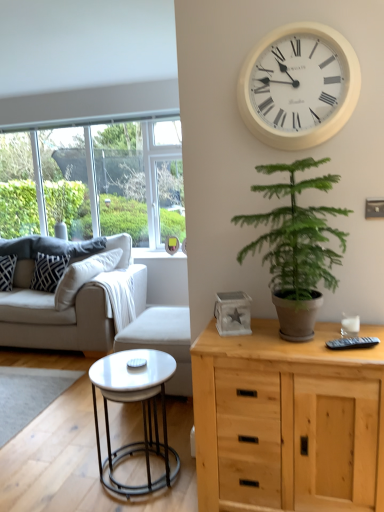
Where is `vacant space underneath white glossy coffee table at lower left (from a real-world perspective)`? The image size is (384, 512). vacant space underneath white glossy coffee table at lower left (from a real-world perspective) is located at coordinates (138, 469).